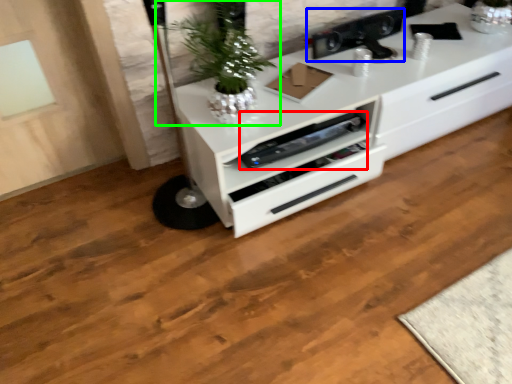
Question: Which is farther away from appliance (highlighted by a red box)? appliance (highlighted by a blue box) or houseplant (highlighted by a green box)?

Choices:
 (A) appliance
 (B) houseplant

Answer: (A)